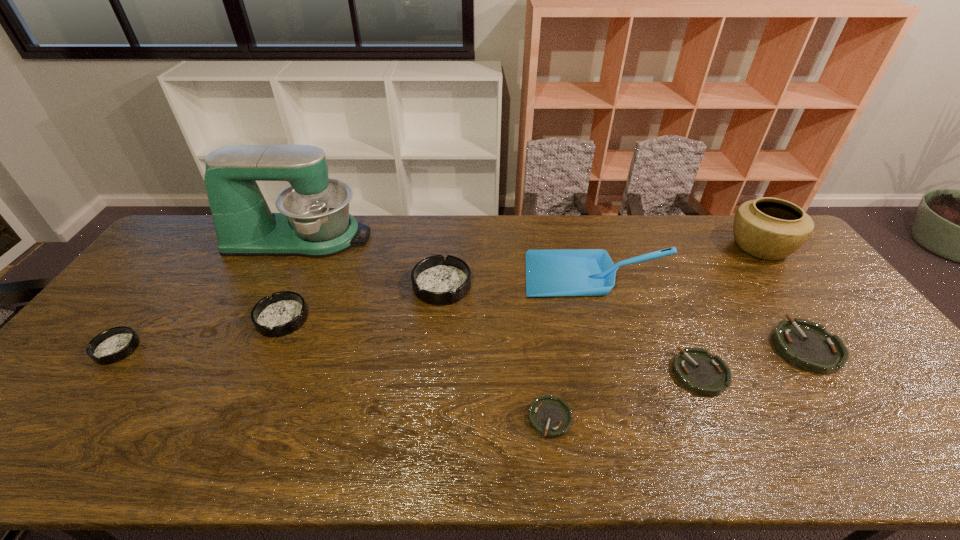
Find the location of a particular element. the leftmost ashtray is located at coordinates (115, 344).

Locate an element on the screen. The width and height of the screenshot is (960, 540). the second ashtray from right to left is located at coordinates (696, 369).

You are a GUI agent. You are given a task and a screenshot of the screen. Output one action in this format:
    pyautogui.click(x=<x>, y=<y>)
    Task: Click on the second smallest green ashtray
    
    Given the screenshot: What is the action you would take?
    pyautogui.click(x=696, y=369)

In order to click on the shortest object in this screenshot , I will do `click(551, 417)`.

The image size is (960, 540). What are the coordinates of `the leftmost green ashtray` in the screenshot? It's located at (551, 417).

Locate an element on the screen. The width and height of the screenshot is (960, 540). blank area located on the front-facing side of the mixer is located at coordinates (423, 238).

This screenshot has width=960, height=540. I want to click on vacant space located on the front of the eighth shortest object, so click(852, 368).

Locate an element on the screen. This screenshot has width=960, height=540. free space located on the left of the dustpan is located at coordinates (407, 275).

The image size is (960, 540). I want to click on free space located on the right of the fourth ashtray from right to left, so click(578, 285).

Locate an element on the screen. free space located on the left of the fifth tallest object is located at coordinates (222, 319).